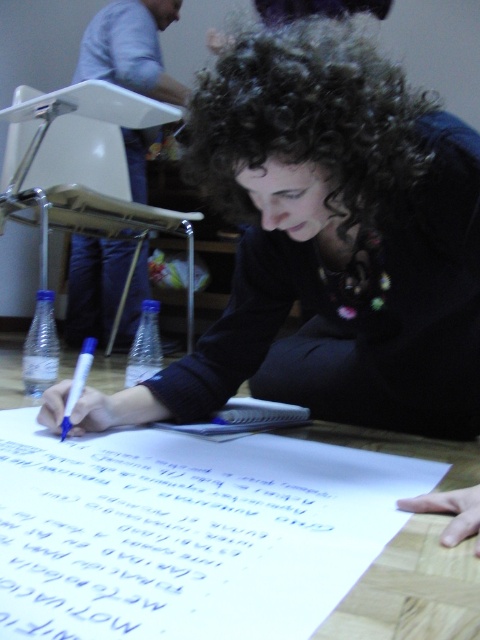
Question: Among these objects, which one is farthest from the camera?

Choices:
 (A) blue marker at lower left
 (B) wooden table at lower center

Answer: (A)

Question: Does blue ink paper at center appear under blue marker at lower left?

Choices:
 (A) yes
 (B) no

Answer: (A)

Question: Which point is farther from the camera taking this photo?

Choices:
 (A) (2, 406)
 (B) (52, 376)
 (C) (90, 342)

Answer: (C)

Question: Which point is closer to the camera taking this photo?

Choices:
 (A) (148, 460)
 (B) (72, 394)

Answer: (A)

Question: Is the position of blue ink paper at center more distant than that of blue marker at lower left?

Choices:
 (A) no
 (B) yes

Answer: (A)

Question: Does blue ink paper at center appear on the right side of blue marker at lower left?

Choices:
 (A) no
 (B) yes

Answer: (B)